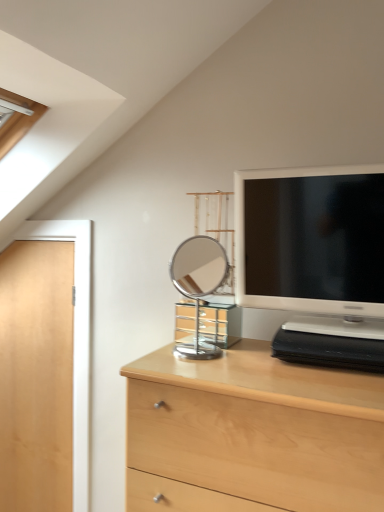
Question: Would you say light wood chest of drawers at center is to the left or to the right of light wood door at left in the picture?

Choices:
 (A) right
 (B) left

Answer: (A)

Question: From the image's perspective, relative to light wood door at left, is light wood chest of drawers at center above or below?

Choices:
 (A) below
 (B) above

Answer: (A)

Question: Which is nearer to the polished chrome mirror at center?

Choices:
 (A) light wood chest of drawers at center
 (B) matte white television at upper right
 (C) light wood door at left

Answer: (C)

Question: Based on their relative distances, which object is nearer to the light wood door at left?

Choices:
 (A) light wood chest of drawers at center
 (B) matte white television at upper right
 (C) polished chrome mirror at center

Answer: (C)